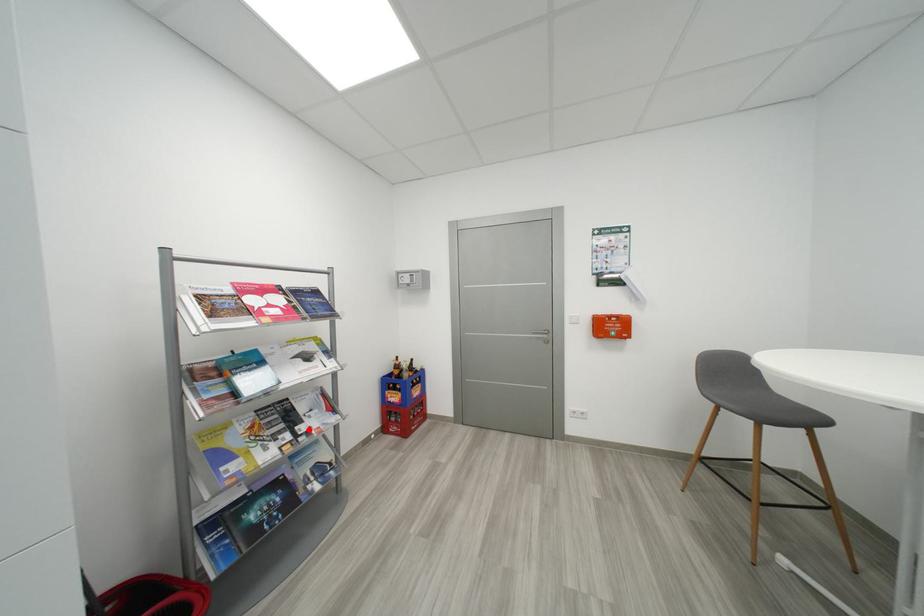
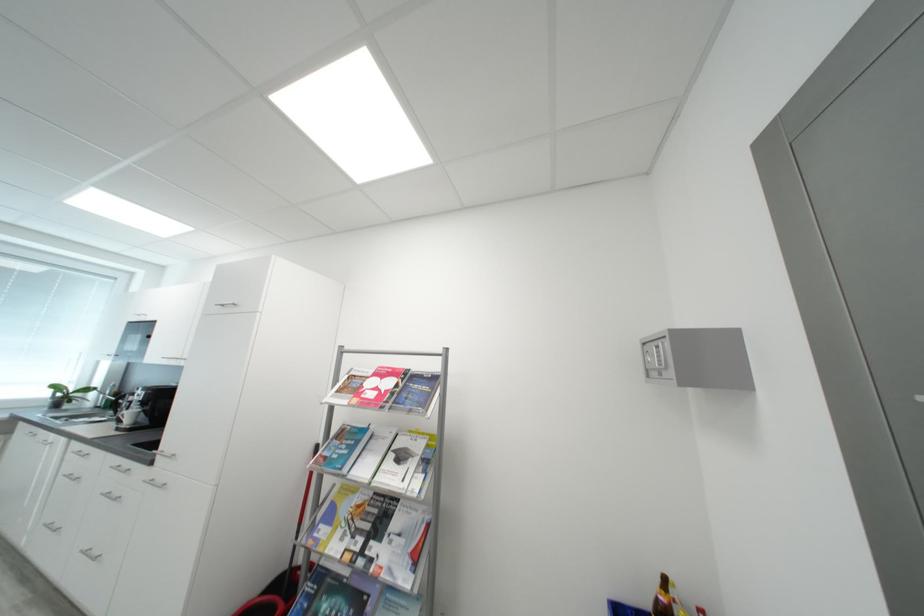
The point at the highlighted location is marked in the first image. Where is the corresponding point in the second image?

(380, 549)